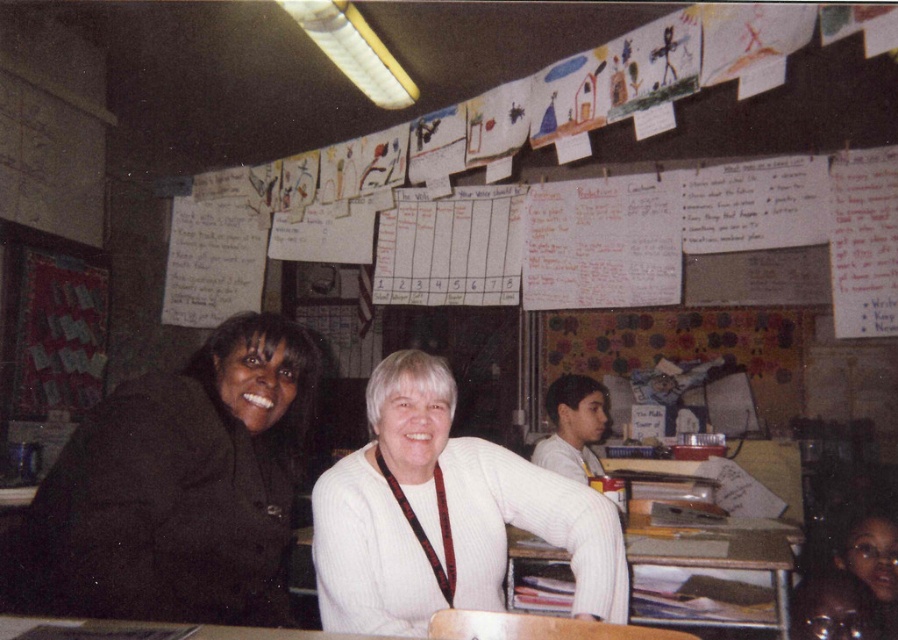
Question: Does white ribbed sweater at center appear on the right side of wooden table at center?

Choices:
 (A) yes
 (B) no

Answer: (B)

Question: Can you confirm if black matte jacket at left is positioned to the right of white ribbed sweater at center?

Choices:
 (A) yes
 (B) no

Answer: (B)

Question: Observing the image, what is the correct spatial positioning of black matte jacket at left in reference to wooden table at center?

Choices:
 (A) left
 (B) right

Answer: (A)

Question: Among these points, which one is nearest to the camera?

Choices:
 (A) pyautogui.click(x=407, y=544)
 (B) pyautogui.click(x=775, y=540)

Answer: (A)

Question: Which is farther from the wooden table at center?

Choices:
 (A) black matte jacket at left
 (B) white ribbed sweater at center

Answer: (A)

Question: Which of the following is the farthest from the observer?

Choices:
 (A) black matte jacket at left
 (B) white ribbed sweater at center
 (C) wooden table at center

Answer: (C)